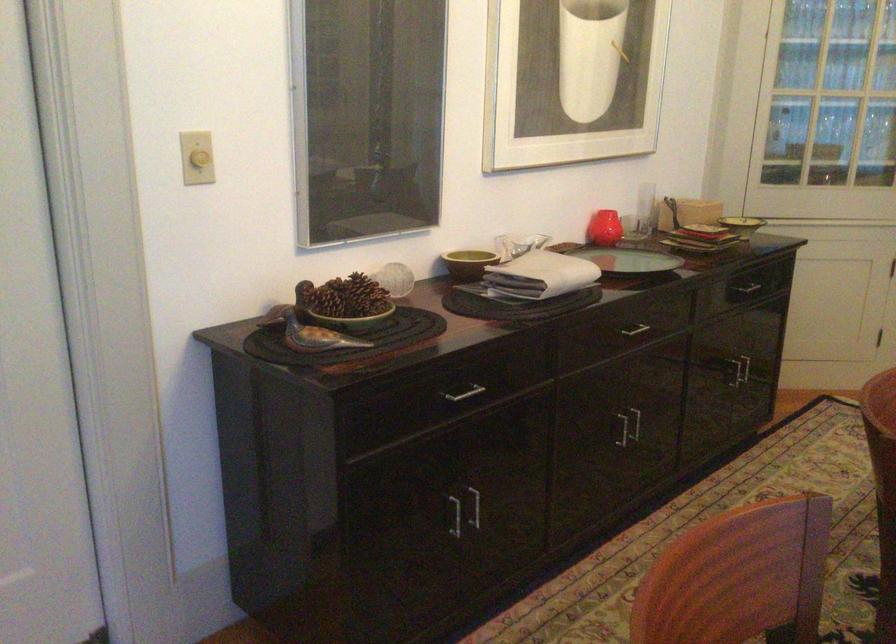
Find the location of a particular element. clear glass bowl is located at coordinates (522, 243).